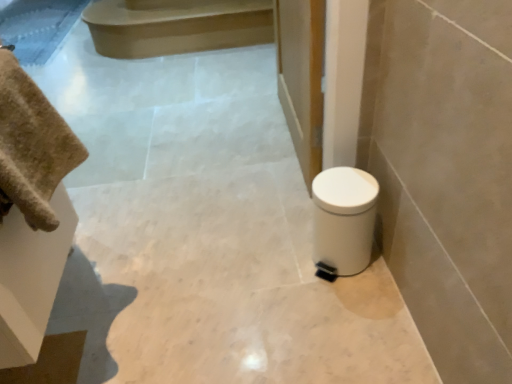
Where is `free space to the left of white plastic toilet at lower right`? This screenshot has width=512, height=384. free space to the left of white plastic toilet at lower right is located at coordinates (275, 266).